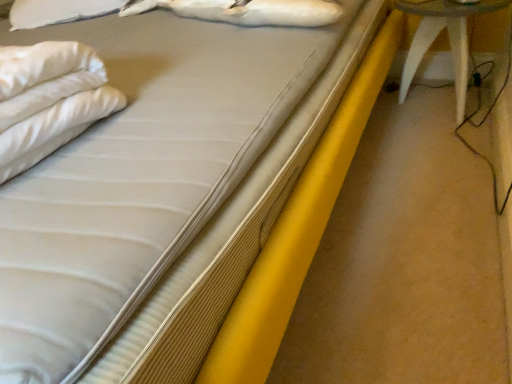
Question: From a real-world perspective, is white plastic stool at right over white fur animal at upper center?

Choices:
 (A) yes
 (B) no

Answer: (B)

Question: From a real-world perspective, does white plastic stool at right sit lower than white fur animal at upper center?

Choices:
 (A) no
 (B) yes

Answer: (B)

Question: Is white plastic stool at right in contact with white fur animal at upper center?

Choices:
 (A) no
 (B) yes

Answer: (A)

Question: Is white plastic stool at right bigger than white fur animal at upper center?

Choices:
 (A) no
 (B) yes

Answer: (B)

Question: Considering the relative sizes of white plastic stool at right and white fur animal at upper center in the image provided, is white plastic stool at right shorter than white fur animal at upper center?

Choices:
 (A) yes
 (B) no

Answer: (B)

Question: From the image's perspective, does white plastic stool at right appear lower than white fur animal at upper center?

Choices:
 (A) yes
 (B) no

Answer: (A)

Question: Can you confirm if white fur animal at upper center is bigger than white plastic stool at right?

Choices:
 (A) yes
 (B) no

Answer: (B)

Question: Does white fur animal at upper center have a greater width compared to white plastic stool at right?

Choices:
 (A) yes
 (B) no

Answer: (B)

Question: Can you confirm if white fur animal at upper center is positioned to the right of white plastic stool at right?

Choices:
 (A) yes
 (B) no

Answer: (B)

Question: Considering the relative sizes of white fur animal at upper center and white plastic stool at right in the image provided, is white fur animal at upper center smaller than white plastic stool at right?

Choices:
 (A) no
 (B) yes

Answer: (B)

Question: Does white fur animal at upper center lie in front of white plastic stool at right?

Choices:
 (A) no
 (B) yes

Answer: (B)

Question: From a real-world perspective, does white fur animal at upper center sit lower than white plastic stool at right?

Choices:
 (A) yes
 (B) no

Answer: (B)

Question: From their relative heights in the image, would you say white fur animal at upper center is taller or shorter than white plastic stool at right?

Choices:
 (A) tall
 (B) short

Answer: (B)